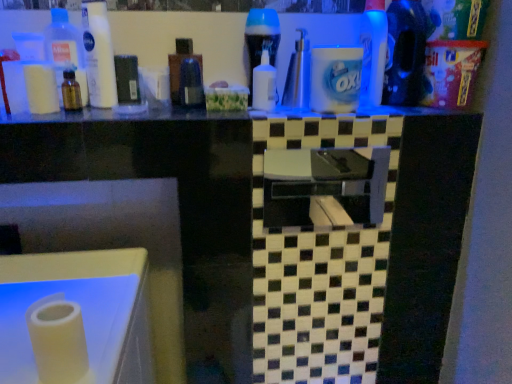
Describe the element at coordinates (180, 65) in the screenshot. Image resolution: width=512 pixels, height=384 pixels. I see `transparent plastic bottle at center, the fourth bottle from the right` at that location.

This screenshot has height=384, width=512. Describe the element at coordinates (71, 92) in the screenshot. I see `brown glass bottle at left, acting as the second bottle starting from the left` at that location.

The width and height of the screenshot is (512, 384). In order to click on blue glossy detergent at upper right, the 2th cleaning product viewed from the right in this screenshot , I will do `click(373, 51)`.

Where is `black glossy sink at center`? black glossy sink at center is located at coordinates (325, 187).

This screenshot has height=384, width=512. Describe the element at coordinates (261, 39) in the screenshot. I see `blue glossy bottle at center, positioned as the third bottle in right-to-left order` at that location.

Describe the element at coordinates (264, 84) in the screenshot. I see `white matte bottle at center, the fifth bottle viewed from the left` at that location.

I want to click on white matte paper towel at lower left, so click(x=58, y=339).

Looking at this image, is transparent plastic bottle at upper left, which is the 6th bottle in right-to-left order, further to camera compared to transparent plastic bottle at center, marked as the third bottle in a left-to-right arrangement?

No, transparent plastic bottle at upper left, which is the 6th bottle in right-to-left order, is closer to the camera.

From the image's perspective, is transparent plastic bottle at upper left, which is counted as the 1th bottle, starting from the left, located above or below transparent plastic bottle at center, marked as the third bottle in a left-to-right arrangement?

transparent plastic bottle at upper left, which is counted as the 1th bottle, starting from the left, is above transparent plastic bottle at center, marked as the third bottle in a left-to-right arrangement.

Which is in front, point (64, 24) or point (174, 88)?

The point (64, 24) is closer.

From the picture: Does blue glossy bottle at center, the fourth bottle viewed from the left, appear on the left side of white matte toilet paper at left?

No.

Considering the positions of objects blue glossy bottle at center, positioned as the third bottle in right-to-left order, and white matte toilet paper at left in the image provided, who is in front, blue glossy bottle at center, positioned as the third bottle in right-to-left order, or white matte toilet paper at left?

white matte toilet paper at left is closer to the camera.

From a real-world perspective, is blue glossy bottle at center, the fourth bottle viewed from the left, located higher than white matte toilet paper at left?

Indeed, from a real-world perspective, blue glossy bottle at center, the fourth bottle viewed from the left, stands above white matte toilet paper at left.

Considering the sizes of objects black glossy sink at center and white matte toilet paper at left in the image provided, who is wider, black glossy sink at center or white matte toilet paper at left?

Wider between the two is white matte toilet paper at left.

From a real-world perspective, between black glossy sink at center and white matte toilet paper at left, who is vertically higher?

white matte toilet paper at left, from a real-world perspective.

What's the angular difference between black glossy sink at center and white matte toilet paper at left's facing directions?

They differ by 0.000984 degrees in their facing directions.

This screenshot has width=512, height=384. In order to click on toilet paper above the black glossy sink at center (from a real-world perspective) in this screenshot , I will do `click(41, 88)`.

Who is taller, brown glass bottle at left, acting as the second bottle starting from the left, or black glossy sink at center?

Standing taller between the two is black glossy sink at center.

Choose the correct answer: Is brown glass bottle at left, the 5th bottle from the right, inside black glossy sink at center or outside it?

brown glass bottle at left, the 5th bottle from the right, cannot be found inside black glossy sink at center.

Looking at their sizes, would you say brown glass bottle at left, acting as the second bottle starting from the left, is wider or thinner than black glossy sink at center?

Clearly, brown glass bottle at left, acting as the second bottle starting from the left, has more width compared to black glossy sink at center.

Is point (68, 78) closer to viewer compared to point (352, 188)?

Yes, it is.

Where is `paper towel that appears on the right of white matte toilet paper at left`? paper towel that appears on the right of white matte toilet paper at left is located at coordinates tap(58, 339).

Between white matte paper towel at lower left and white matte toilet paper at left, which one appears on the left side from the viewer's perspective?

From the viewer's perspective, white matte toilet paper at left appears more on the left side.

From a real-world perspective, is white matte paper towel at lower left located higher than white matte toilet paper at left?

Incorrect, from a real-world perspective, white matte paper towel at lower left is lower than white matte toilet paper at left.

Is white matte paper towel at lower left far away from white matte toilet paper at left?

No, there isn't a large distance between white matte paper towel at lower left and white matte toilet paper at left.

Considering the relative sizes of transparent plastic bottle at upper left, which is counted as the 1th bottle, starting from the left, and blue glossy detergent at upper right, the 2th cleaning product viewed from the right, in the image provided, is transparent plastic bottle at upper left, which is counted as the 1th bottle, starting from the left, bigger than blue glossy detergent at upper right, the 2th cleaning product viewed from the right,?

Actually, transparent plastic bottle at upper left, which is counted as the 1th bottle, starting from the left, might be smaller than blue glossy detergent at upper right, the 2th cleaning product viewed from the right.

Considering the positions of objects transparent plastic bottle at upper left, which is counted as the 1th bottle, starting from the left, and blue glossy detergent at upper right, which ranks as the 2th cleaning product in left-to-right order, in the image provided, who is more to the left, transparent plastic bottle at upper left, which is counted as the 1th bottle, starting from the left, or blue glossy detergent at upper right, which ranks as the 2th cleaning product in left-to-right order,?

From the viewer's perspective, transparent plastic bottle at upper left, which is counted as the 1th bottle, starting from the left, appears more on the left side.

From the image's perspective, does transparent plastic bottle at upper left, which is the 6th bottle in right-to-left order, appear higher than blue glossy detergent at upper right, which ranks as the 2th cleaning product in left-to-right order?

No, from the image's perspective, transparent plastic bottle at upper left, which is the 6th bottle in right-to-left order, is not over blue glossy detergent at upper right, which ranks as the 2th cleaning product in left-to-right order.

Would you say transparent plastic bottle at upper left, which is counted as the 1th bottle, starting from the left, is outside blue glossy detergent at upper right, the 2th cleaning product viewed from the right?

Yes, transparent plastic bottle at upper left, which is counted as the 1th bottle, starting from the left, is located beyond the bounds of blue glossy detergent at upper right, the 2th cleaning product viewed from the right.

Are white matte toilet paper at left and transparent plastic bottle at center, the fourth bottle from the right, located far from each other?

Actually, white matte toilet paper at left and transparent plastic bottle at center, the fourth bottle from the right, are a little close together.

Measure the distance from white matte toilet paper at left to transparent plastic bottle at center, the fourth bottle from the right.

9.71 inches.

Could transparent plastic bottle at center, the fourth bottle from the right, be considered to be inside white matte toilet paper at left?

No, transparent plastic bottle at center, the fourth bottle from the right, is not surrounded by white matte toilet paper at left.

Can you tell me how much white matte toilet paper at left and transparent plastic bottle at center, marked as the third bottle in a left-to-right arrangement, differ in facing direction?

The facing directions of white matte toilet paper at left and transparent plastic bottle at center, marked as the third bottle in a left-to-right arrangement, are 0.00142 degrees apart.

From the transparent plastic bottle at center, marked as the third bottle in a left-to-right arrangement, count the 2nd bottle to the left and point to it. Please provide its 2D coordinates.

[(65, 50)]

Where is `toilet paper that is below the blue glossy bottle at center, positioned as the third bottle in right-to-left order (from the image's perspective)`? This screenshot has width=512, height=384. toilet paper that is below the blue glossy bottle at center, positioned as the third bottle in right-to-left order (from the image's perspective) is located at coordinates [41, 88].

Which object lies further to the anchor point white matte toilet paper at left, white matte lotion at upper left, marked as the third cleaning product in a right-to-left arrangement, or white matte bottle at center, the fifth bottle viewed from the left?

white matte bottle at center, the fifth bottle viewed from the left, lies further to white matte toilet paper at left than the other object.

Estimate the real-world distances between objects in this image. Which object is further from white matte lotion at upper left, acting as the first cleaning product starting from the left, blue glossy bottle at center, the fourth bottle viewed from the left, or blue glossy detergent at upper right, which ranks as the 2th cleaning product in left-to-right order?

blue glossy detergent at upper right, which ranks as the 2th cleaning product in left-to-right order, lies further to white matte lotion at upper left, acting as the first cleaning product starting from the left, than the other object.

From the picture: Considering their positions, is transparent plastic bottle at center, the fourth bottle from the right, positioned further to white matte lotion at upper left, marked as the third cleaning product in a right-to-left arrangement, than white matte toilet paper at left?

transparent plastic bottle at center, the fourth bottle from the right, is positioned further to the anchor white matte lotion at upper left, marked as the third cleaning product in a right-to-left arrangement.

Considering their positions, is white matte bottle at center, which is the second bottle in right-to-left order, positioned closer to blue glossy bottle at upper right, the first cleaning product from the right, than translucent plastic soap dispenser at center, the 6th bottle from the left?

translucent plastic soap dispenser at center, the 6th bottle from the left, lies closer to blue glossy bottle at upper right, the first cleaning product from the right, than the other object.

Based on their spatial positions, is brown glass bottle at left, the 5th bottle from the right, or blue glossy detergent at upper right, the 2th cleaning product viewed from the right, closer to white matte paper towel at lower left?

brown glass bottle at left, the 5th bottle from the right, is positioned closer to the anchor white matte paper towel at lower left.

From the image, which object appears to be nearer to black glossy sink at center, blue glossy detergent at upper right, which ranks as the 2th cleaning product in left-to-right order, or translucent plastic soap dispenser at center, the 6th bottle from the left?

blue glossy detergent at upper right, which ranks as the 2th cleaning product in left-to-right order.

When comparing their distances from black glossy sink at center, does transparent plastic bottle at center, the fourth bottle from the right, or white matte bottle at center, the fifth bottle viewed from the left, seem further?

transparent plastic bottle at center, the fourth bottle from the right, is positioned further to the anchor black glossy sink at center.

From the image, which object appears to be farther from white matte bottle at center, the fifth bottle viewed from the left, transparent plastic bottle at upper left, which is counted as the 1th bottle, starting from the left, or brown glass bottle at left, the 5th bottle from the right?

transparent plastic bottle at upper left, which is counted as the 1th bottle, starting from the left, is further to white matte bottle at center, the fifth bottle viewed from the left.

Where is `toilet paper between brown glass bottle at left, acting as the second bottle starting from the left, and white matte paper towel at lower left in the up-down direction`? This screenshot has width=512, height=384. toilet paper between brown glass bottle at left, acting as the second bottle starting from the left, and white matte paper towel at lower left in the up-down direction is located at coordinates (41, 88).

Locate an element on the screen. sink between brown glass bottle at left, acting as the second bottle starting from the left, and blue glossy detergent at upper right, the 2th cleaning product viewed from the right is located at coordinates (325, 187).

Locate an element on the screen. Image resolution: width=512 pixels, height=384 pixels. paper towel between white matte toilet paper at left and blue glossy bottle at upper right, which ranks as the third cleaning product in left-to-right order, from left to right is located at coordinates (58, 339).

This screenshot has height=384, width=512. In order to click on counter top between transparent plastic bottle at upper left, which is counted as the 1th bottle, starting from the left, and blue glossy bottle at center, positioned as the third bottle in right-to-left order, in the horizontal direction in this screenshot , I will do `click(120, 116)`.